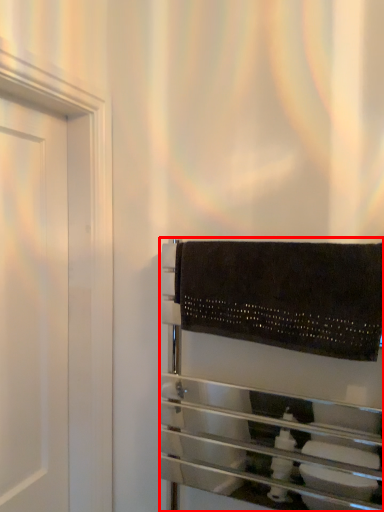
Question: Considering the relative positions of towel rack (annotated by the red box) and bath towel in the image provided, where is towel rack (annotated by the red box) located with respect to the staircase?

Choices:
 (A) left
 (B) right

Answer: (A)